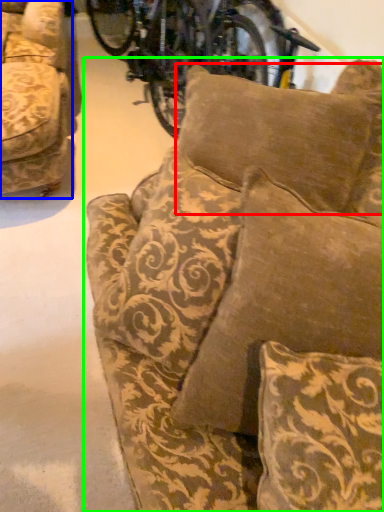
Question: Which object is positioned farthest from pillow (highlighted by a red box)? Select from studio couch (highlighted by a blue box) and studio couch (highlighted by a green box).

Choices:
 (A) studio couch
 (B) studio couch

Answer: (A)